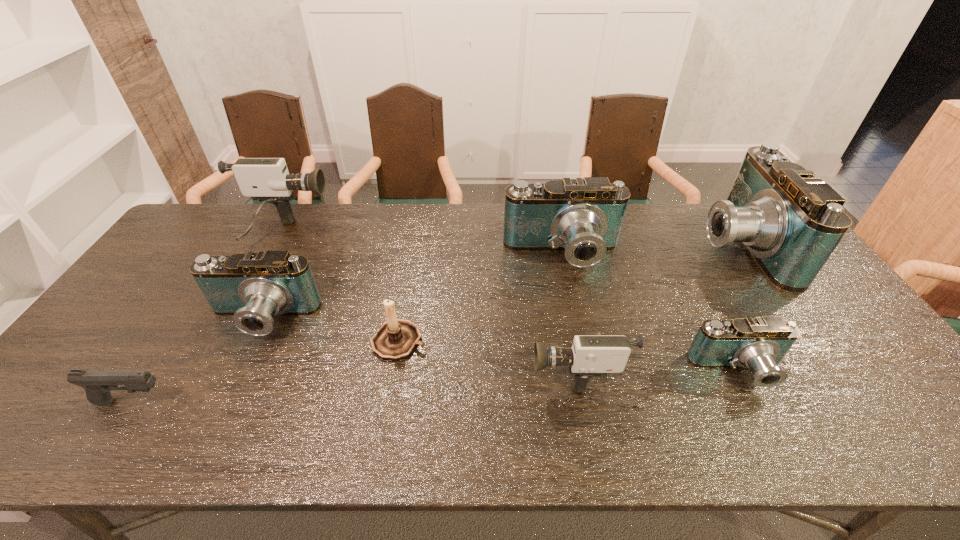
At what (x,y) coordinates should I click in order to perform the action: click on free space between the nearest blue camcorder and the right white camcorder. Please return your answer as a coordinate pair (x, y). This screenshot has height=540, width=960. Looking at the image, I should click on (657, 370).

Find the location of `object that is the fifth closest to the candle holder`. object that is the fifth closest to the candle holder is located at coordinates (97, 384).

Locate which object ranks in proximity to the nearest blue camcorder. Please provide its 2D coordinates. Your answer should be formatted as a tuple, i.e. [(x, y)], where the tuple contains the x and y coordinates of a point satisfying the conditions above.

[(590, 355)]

Locate which camcorder is the second closest to the right white camcorder. Please provide its 2D coordinates. Your answer should be formatted as a tuple, i.e. [(x, y)], where the tuple contains the x and y coordinates of a point satisfying the conditions above.

[(583, 217)]

The image size is (960, 540). I want to click on camcorder that is the closest to the biggest blue camcorder, so click(759, 344).

This screenshot has width=960, height=540. Find the location of `blue camcorder that is the closest to the shortest camcorder`. blue camcorder that is the closest to the shortest camcorder is located at coordinates (791, 222).

Locate which blue camcorder ranks in proximity to the second blue camcorder from left to right. Please provide its 2D coordinates. Your answer should be formatted as a tuple, i.e. [(x, y)], where the tuple contains the x and y coordinates of a point satisfying the conditions above.

[(791, 222)]

The height and width of the screenshot is (540, 960). I want to click on free spot that satisfies the following two spatial constraints: 1. on the front-facing side of the fourth object from left to right; 2. on the right side of the leftmost blue camcorder, so click(x=252, y=341).

This screenshot has height=540, width=960. I want to click on vacant space that satisfies the following two spatial constraints: 1. on the front-facing side of the second nearest blue camcorder; 2. at the barrel of the pistol, so click(x=222, y=402).

The height and width of the screenshot is (540, 960). What are the coordinates of `free space that satisfies the following two spatial constraints: 1. on the front-facing side of the biggest blue camcorder; 2. on the front-facing side of the second smallest blue camcorder` in the screenshot? It's located at (788, 320).